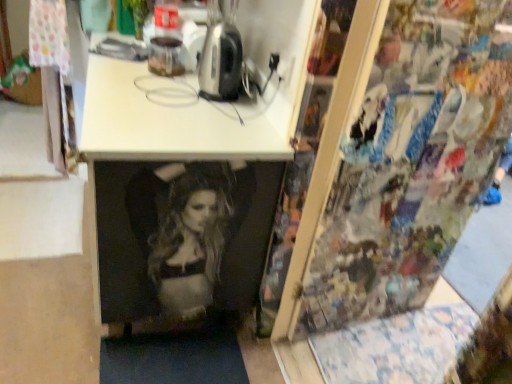
Question: Is metallic silver toaster at upper center surrounded by white plastic iron at upper center?

Choices:
 (A) yes
 (B) no

Answer: (B)

Question: Can you confirm if white plastic iron at upper center is bigger than metallic silver toaster at upper center?

Choices:
 (A) no
 (B) yes

Answer: (B)

Question: From the image's perspective, is white plastic iron at upper center under metallic silver toaster at upper center?

Choices:
 (A) yes
 (B) no

Answer: (A)

Question: Can you confirm if white plastic iron at upper center is taller than metallic silver toaster at upper center?

Choices:
 (A) no
 (B) yes

Answer: (A)

Question: Is white plastic iron at upper center facing away from metallic silver toaster at upper center?

Choices:
 (A) yes
 (B) no

Answer: (B)

Question: From a real-world perspective, is white plastic iron at upper center positioned under metallic silver toaster at upper center based on gravity?

Choices:
 (A) no
 (B) yes

Answer: (B)

Question: Are metallic silver toaster at upper center and white plastic iron at upper center located far from each other?

Choices:
 (A) yes
 (B) no

Answer: (B)

Question: Considering the relative positions of metallic silver toaster at upper center and white plastic iron at upper center in the image provided, is metallic silver toaster at upper center to the left of white plastic iron at upper center from the viewer's perspective?

Choices:
 (A) no
 (B) yes

Answer: (A)

Question: Does metallic silver toaster at upper center have a smaller size compared to white plastic iron at upper center?

Choices:
 (A) yes
 (B) no

Answer: (A)

Question: Is metallic silver toaster at upper center touching white plastic iron at upper center?

Choices:
 (A) yes
 (B) no

Answer: (B)

Question: Is metallic silver toaster at upper center positioned in front of white plastic iron at upper center?

Choices:
 (A) yes
 (B) no

Answer: (B)

Question: Is metallic silver toaster at upper center not inside white plastic iron at upper center?

Choices:
 (A) no
 (B) yes

Answer: (B)

Question: Is point [202, 48] positioned closer to the camera than point [110, 132]?

Choices:
 (A) farther
 (B) closer

Answer: (A)